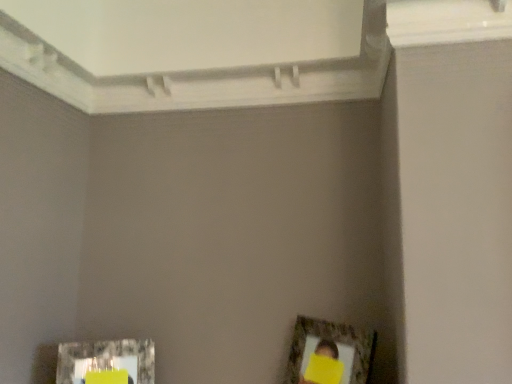
Identify the location of wooden textured picture frame at lower right, placed as the second picture frame when sorted from left to right. (329, 353).

Image resolution: width=512 pixels, height=384 pixels. What do you see at coordinates (329, 353) in the screenshot?
I see `wooden textured picture frame at lower right, placed as the second picture frame when sorted from left to right` at bounding box center [329, 353].

How much space does wooden textured picture frame at lower right, positioned as the 1th picture frame in right-to-left order, occupy horizontally?

wooden textured picture frame at lower right, positioned as the 1th picture frame in right-to-left order, is 19.25 centimeters wide.

Locate an element on the screen. The height and width of the screenshot is (384, 512). metallic silver picture frame at lower left, which is counted as the first picture frame, starting from the left is located at coordinates (106, 360).

What is the approximate width of metallic silver picture frame at lower left, which is counted as the first picture frame, starting from the left?

The width of metallic silver picture frame at lower left, which is counted as the first picture frame, starting from the left, is 3.95 inches.

The image size is (512, 384). What do you see at coordinates (106, 360) in the screenshot? I see `metallic silver picture frame at lower left, which is counted as the first picture frame, starting from the left` at bounding box center [106, 360].

Identify the location of wooden textured picture frame at lower right, placed as the second picture frame when sorted from left to right. The image size is (512, 384). (329, 353).

Would you say wooden textured picture frame at lower right, positioned as the 1th picture frame in right-to-left order, is to the left or to the right of metallic silver picture frame at lower left, which is counted as the first picture frame, starting from the left, in the picture?

wooden textured picture frame at lower right, positioned as the 1th picture frame in right-to-left order, is positioned on metallic silver picture frame at lower left, which is counted as the first picture frame, starting from the left,'s right side.

Does wooden textured picture frame at lower right, placed as the second picture frame when sorted from left to right, come behind metallic silver picture frame at lower left, which is counted as the first picture frame, starting from the left?

No, wooden textured picture frame at lower right, placed as the second picture frame when sorted from left to right, is closer to the camera.

Which is closer, (297, 319) or (105, 359)?

Positioned in front is point (105, 359).

From the image's perspective, is wooden textured picture frame at lower right, positioned as the 1th picture frame in right-to-left order, located above metallic silver picture frame at lower left, which is counted as the first picture frame, starting from the left?

Indeed, from the image's perspective, wooden textured picture frame at lower right, positioned as the 1th picture frame in right-to-left order, is shown above metallic silver picture frame at lower left, which is counted as the first picture frame, starting from the left.

From a real-world perspective, is wooden textured picture frame at lower right, positioned as the 1th picture frame in right-to-left order, under metallic silver picture frame at lower left, which is counted as the first picture frame, starting from the left?

Actually, wooden textured picture frame at lower right, positioned as the 1th picture frame in right-to-left order, is physically above metallic silver picture frame at lower left, which is counted as the first picture frame, starting from the left, in the real world.

Which of these two, wooden textured picture frame at lower right, placed as the second picture frame when sorted from left to right, or metallic silver picture frame at lower left, which ranks as the second picture frame in right-to-left order, is thinner?

Thinner between the two is metallic silver picture frame at lower left, which ranks as the second picture frame in right-to-left order.

Considering the sizes of wooden textured picture frame at lower right, placed as the second picture frame when sorted from left to right, and metallic silver picture frame at lower left, which is counted as the first picture frame, starting from the left, in the image, is wooden textured picture frame at lower right, placed as the second picture frame when sorted from left to right, taller or shorter than metallic silver picture frame at lower left, which is counted as the first picture frame, starting from the left,?

Clearly, wooden textured picture frame at lower right, placed as the second picture frame when sorted from left to right, is taller compared to metallic silver picture frame at lower left, which is counted as the first picture frame, starting from the left.

Is wooden textured picture frame at lower right, placed as the second picture frame when sorted from left to right, smaller than metallic silver picture frame at lower left, which is counted as the first picture frame, starting from the left?

Incorrect, wooden textured picture frame at lower right, placed as the second picture frame when sorted from left to right, is not smaller in size than metallic silver picture frame at lower left, which is counted as the first picture frame, starting from the left.

Would you say wooden textured picture frame at lower right, positioned as the 1th picture frame in right-to-left order, is outside metallic silver picture frame at lower left, which ranks as the second picture frame in right-to-left order?

Yes, wooden textured picture frame at lower right, positioned as the 1th picture frame in right-to-left order, is not within metallic silver picture frame at lower left, which ranks as the second picture frame in right-to-left order.

Looking at this image, is wooden textured picture frame at lower right, placed as the second picture frame when sorted from left to right, placed right next to metallic silver picture frame at lower left, which ranks as the second picture frame in right-to-left order?

No, wooden textured picture frame at lower right, placed as the second picture frame when sorted from left to right, is not in contact with metallic silver picture frame at lower left, which ranks as the second picture frame in right-to-left order.

Is wooden textured picture frame at lower right, placed as the second picture frame when sorted from left to right, oriented away from metallic silver picture frame at lower left, which ranks as the second picture frame in right-to-left order?

No, wooden textured picture frame at lower right, placed as the second picture frame when sorted from left to right, is not facing away from metallic silver picture frame at lower left, which ranks as the second picture frame in right-to-left order.

How many degrees apart are the facing directions of wooden textured picture frame at lower right, placed as the second picture frame when sorted from left to right, and metallic silver picture frame at lower left, which is counted as the first picture frame, starting from the left?

wooden textured picture frame at lower right, placed as the second picture frame when sorted from left to right, and metallic silver picture frame at lower left, which is counted as the first picture frame, starting from the left, are facing 74.7 degrees away from each other.

Could you measure the distance between wooden textured picture frame at lower right, placed as the second picture frame when sorted from left to right, and metallic silver picture frame at lower left, which is counted as the first picture frame, starting from the left?

A distance of 23.02 inches exists between wooden textured picture frame at lower right, placed as the second picture frame when sorted from left to right, and metallic silver picture frame at lower left, which is counted as the first picture frame, starting from the left.

Locate an element on the screen. The image size is (512, 384). picture frame that is above the metallic silver picture frame at lower left, which ranks as the second picture frame in right-to-left order (from a real-world perspective) is located at coordinates (329, 353).

Which is more to the left, metallic silver picture frame at lower left, which is counted as the first picture frame, starting from the left, or wooden textured picture frame at lower right, positioned as the 1th picture frame in right-to-left order?

metallic silver picture frame at lower left, which is counted as the first picture frame, starting from the left.

Considering the relative positions of metallic silver picture frame at lower left, which ranks as the second picture frame in right-to-left order, and wooden textured picture frame at lower right, placed as the second picture frame when sorted from left to right, in the image provided, is metallic silver picture frame at lower left, which ranks as the second picture frame in right-to-left order, behind wooden textured picture frame at lower right, placed as the second picture frame when sorted from left to right,?

Yes.

Considering the positions of points (77, 370) and (352, 370), is point (77, 370) closer to camera compared to point (352, 370)?

No, (77, 370) is further to viewer.

From the image's perspective, between metallic silver picture frame at lower left, which ranks as the second picture frame in right-to-left order, and wooden textured picture frame at lower right, placed as the second picture frame when sorted from left to right, which one is located above?

wooden textured picture frame at lower right, placed as the second picture frame when sorted from left to right, appears higher in the image.

From a real-world perspective, is metallic silver picture frame at lower left, which is counted as the first picture frame, starting from the left, on top of wooden textured picture frame at lower right, placed as the second picture frame when sorted from left to right?

Actually, metallic silver picture frame at lower left, which is counted as the first picture frame, starting from the left, is physically below wooden textured picture frame at lower right, placed as the second picture frame when sorted from left to right, in the real world.

Which of these two, metallic silver picture frame at lower left, which is counted as the first picture frame, starting from the left, or wooden textured picture frame at lower right, placed as the second picture frame when sorted from left to right, is thinner?

metallic silver picture frame at lower left, which is counted as the first picture frame, starting from the left.

Between metallic silver picture frame at lower left, which is counted as the first picture frame, starting from the left, and wooden textured picture frame at lower right, placed as the second picture frame when sorted from left to right, which one has more height?

With more height is wooden textured picture frame at lower right, placed as the second picture frame when sorted from left to right.

Considering the sizes of objects metallic silver picture frame at lower left, which is counted as the first picture frame, starting from the left, and wooden textured picture frame at lower right, placed as the second picture frame when sorted from left to right, in the image provided, who is smaller, metallic silver picture frame at lower left, which is counted as the first picture frame, starting from the left, or wooden textured picture frame at lower right, placed as the second picture frame when sorted from left to right,?

With smaller size is metallic silver picture frame at lower left, which is counted as the first picture frame, starting from the left.

Is metallic silver picture frame at lower left, which ranks as the second picture frame in right-to-left order, completely or partially outside of wooden textured picture frame at lower right, positioned as the 1th picture frame in right-to-left order?

metallic silver picture frame at lower left, which ranks as the second picture frame in right-to-left order, lies outside wooden textured picture frame at lower right, positioned as the 1th picture frame in right-to-left order,'s area.

Are metallic silver picture frame at lower left, which ranks as the second picture frame in right-to-left order, and wooden textured picture frame at lower right, placed as the second picture frame when sorted from left to right, making contact?

No, metallic silver picture frame at lower left, which ranks as the second picture frame in right-to-left order, is not with wooden textured picture frame at lower right, placed as the second picture frame when sorted from left to right.

Is metallic silver picture frame at lower left, which is counted as the first picture frame, starting from the left, oriented towards wooden textured picture frame at lower right, positioned as the 1th picture frame in right-to-left order?

No, metallic silver picture frame at lower left, which is counted as the first picture frame, starting from the left, is not turned towards wooden textured picture frame at lower right, positioned as the 1th picture frame in right-to-left order.

How distant is metallic silver picture frame at lower left, which ranks as the second picture frame in right-to-left order, from wooden textured picture frame at lower right, positioned as the 1th picture frame in right-to-left order?

metallic silver picture frame at lower left, which ranks as the second picture frame in right-to-left order, and wooden textured picture frame at lower right, positioned as the 1th picture frame in right-to-left order, are 23.02 inches apart.

This screenshot has width=512, height=384. I want to click on picture frame above the metallic silver picture frame at lower left, which is counted as the first picture frame, starting from the left (from the image's perspective), so (x=329, y=353).

This screenshot has width=512, height=384. I want to click on picture frame on the left of the wooden textured picture frame at lower right, placed as the second picture frame when sorted from left to right, so click(x=106, y=360).

Image resolution: width=512 pixels, height=384 pixels. In order to click on picture frame positioned vertically above the metallic silver picture frame at lower left, which is counted as the first picture frame, starting from the left (from a real-world perspective) in this screenshot , I will do pos(329,353).